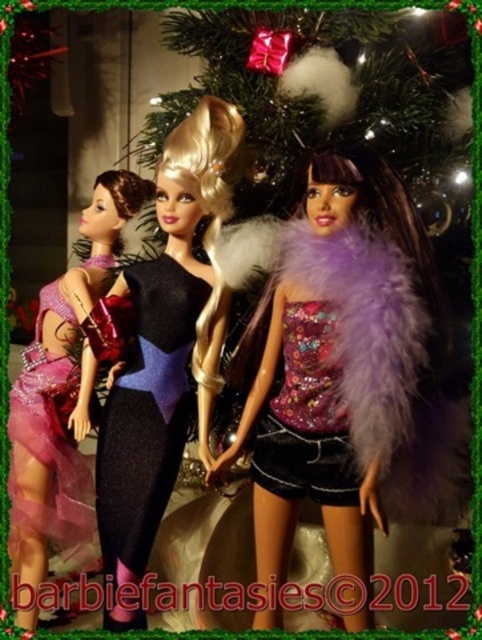
Between green textured christmas tree at center and black textured dress at center, which one has less height?

black textured dress at center

Does green textured christmas tree at center appear under black textured dress at center?

Incorrect, green textured christmas tree at center is not positioned below black textured dress at center.

The image size is (482, 640). I want to click on green textured christmas tree at center, so 373,330.

The image size is (482, 640). In order to click on green textured christmas tree at center in this screenshot , I will do `click(373, 330)`.

This screenshot has height=640, width=482. What do you see at coordinates (373, 330) in the screenshot?
I see `green textured christmas tree at center` at bounding box center [373, 330].

Who is lower down, green textured christmas tree at center or black sequined dress at center?

black sequined dress at center

Is point (395, 483) positioned after point (219, 152)?

No, (395, 483) is in front of (219, 152).

Where is `green textured christmas tree at center`? Image resolution: width=482 pixels, height=640 pixels. green textured christmas tree at center is located at coordinates (373, 330).

Is matte pink tulle dress at left in front of black textured dress at center?

No.

Is point (34, 385) positioned in front of point (138, 396)?

No, (34, 385) is behind (138, 396).

Which is in front, point (77, 246) or point (135, 406)?

Point (135, 406) is in front.

Find the location of a particular element. matte pink tulle dress at left is located at coordinates (62, 397).